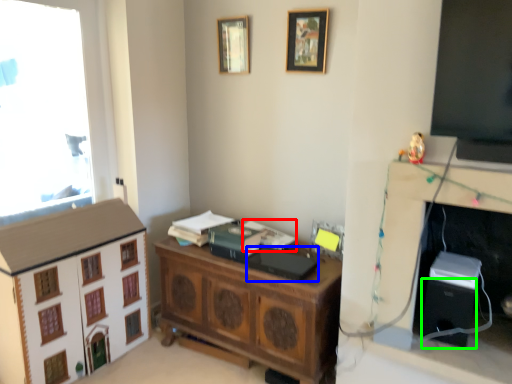
Question: Which object is the farthest from book (highlighted by a red box)? Choose among these: book (highlighted by a blue box) or speaker (highlighted by a green box).

Choices:
 (A) book
 (B) speaker

Answer: (B)